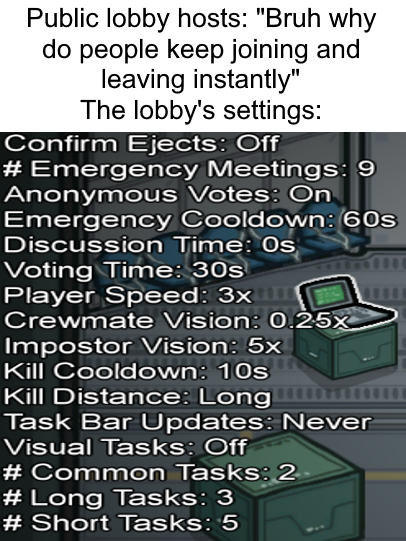
Locate an element on the screen. Image resolution: width=406 pixels, height=541 pixels. picture is located at coordinates (367, 361).